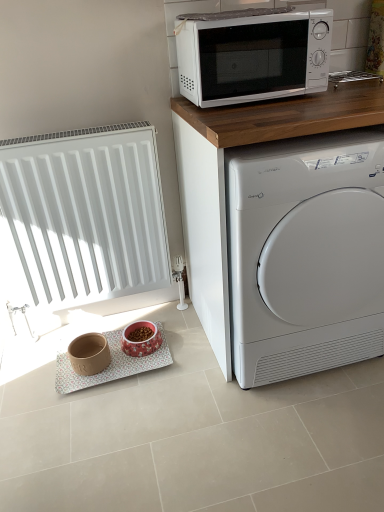
Question: Is pink glossy bowl at lower center, the first appliance viewed from the right, shorter than white matte radiator at left?

Choices:
 (A) yes
 (B) no

Answer: (A)

Question: Does pink glossy bowl at lower center, the first appliance viewed from the right, lie in front of white matte radiator at left?

Choices:
 (A) no
 (B) yes

Answer: (A)

Question: Is pink glossy bowl at lower center, the first appliance viewed from the right, to the left of white matte radiator at left from the viewer's perspective?

Choices:
 (A) yes
 (B) no

Answer: (B)

Question: Is pink glossy bowl at lower center, the 2th appliance viewed from the left, facing towards white matte radiator at left?

Choices:
 (A) no
 (B) yes

Answer: (A)

Question: Is pink glossy bowl at lower center, the first appliance viewed from the right, thinner than white matte radiator at left?

Choices:
 (A) no
 (B) yes

Answer: (A)

Question: Is white matte radiator at left situated inside matte brown bowl at lower left, marked as the 2th appliance in a right-to-left arrangement, or outside?

Choices:
 (A) inside
 (B) outside

Answer: (B)

Question: Considering the positions of white matte radiator at left and matte brown bowl at lower left, the 1th appliance when ordered from left to right, in the image, is white matte radiator at left taller or shorter than matte brown bowl at lower left, the 1th appliance when ordered from left to right,?

Choices:
 (A) tall
 (B) short

Answer: (A)

Question: From the image's perspective, is white matte radiator at left above or below matte brown bowl at lower left, the 1th appliance when ordered from left to right?

Choices:
 (A) above
 (B) below

Answer: (A)

Question: From a real-world perspective, is white matte radiator at left positioned above or below matte brown bowl at lower left, marked as the 2th appliance in a right-to-left arrangement?

Choices:
 (A) above
 (B) below

Answer: (A)

Question: Visually, is matte brown bowl at lower left, the 1th appliance when ordered from left to right, positioned to the left or to the right of white glossy washing machine at right?

Choices:
 (A) right
 (B) left

Answer: (B)

Question: Is matte brown bowl at lower left, the 1th appliance when ordered from left to right, spatially inside white glossy washing machine at right, or outside of it?

Choices:
 (A) inside
 (B) outside

Answer: (B)

Question: Is point (82, 358) closer or farther from the camera than point (297, 324)?

Choices:
 (A) farther
 (B) closer

Answer: (A)

Question: In terms of width, does matte brown bowl at lower left, the 1th appliance when ordered from left to right, look wider or thinner when compared to white glossy washing machine at right?

Choices:
 (A) wide
 (B) thin

Answer: (B)

Question: Is matte brown bowl at lower left, marked as the 2th appliance in a right-to-left arrangement, inside or outside of white matte radiator at left?

Choices:
 (A) inside
 (B) outside

Answer: (B)

Question: Considering the positions of matte brown bowl at lower left, the 1th appliance when ordered from left to right, and white matte radiator at left in the image, is matte brown bowl at lower left, the 1th appliance when ordered from left to right, bigger or smaller than white matte radiator at left?

Choices:
 (A) small
 (B) big

Answer: (A)